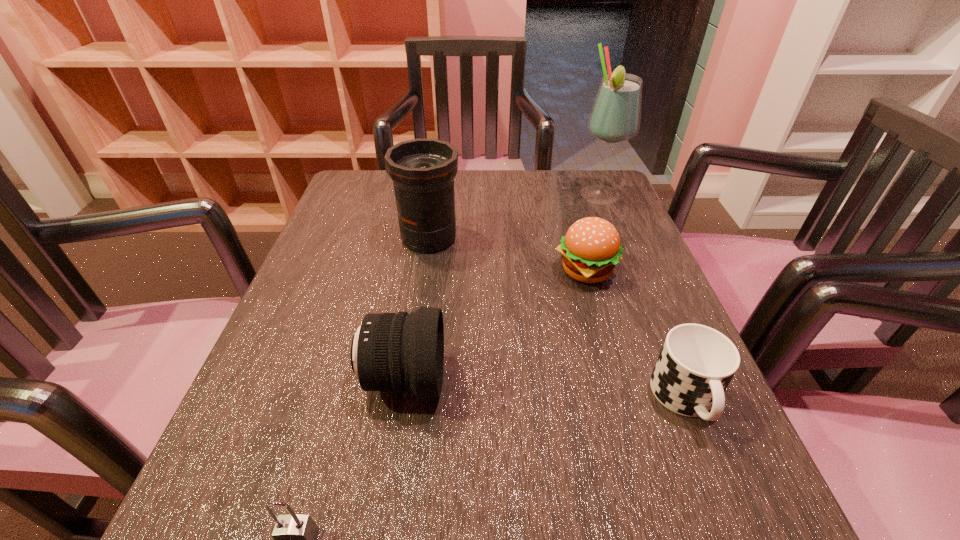
Find the location of a particular element. This screenshot has height=540, width=960. the farthest object is located at coordinates (615, 117).

Where is `alcohol`? alcohol is located at coordinates (615, 117).

Where is `the taller telephoto lens`? the taller telephoto lens is located at coordinates (423, 170).

Locate an element on the screen. The image size is (960, 540). the second tallest object is located at coordinates (423, 170).

Locate an element on the screen. This screenshot has width=960, height=540. the nearer telephoto lens is located at coordinates (389, 351).

I want to click on hamburger, so click(x=590, y=250).

At what (x,y) coordinates should I click in order to perform the action: click on cup. Please return your answer as a coordinate pair (x, y). This screenshot has height=540, width=960. Looking at the image, I should click on (696, 364).

The width and height of the screenshot is (960, 540). I want to click on free spot located on the left of the alcohol, so click(x=452, y=195).

Image resolution: width=960 pixels, height=540 pixels. Find the location of `vacant region located 0.370m on the right of the taller telephoto lens`. vacant region located 0.370m on the right of the taller telephoto lens is located at coordinates (622, 238).

At what (x,y) coordinates should I click in order to perform the action: click on free region located 0.270m at the front element of the nearer telephoto lens. Please return your answer as a coordinate pair (x, y). This screenshot has height=540, width=960. Looking at the image, I should click on (609, 380).